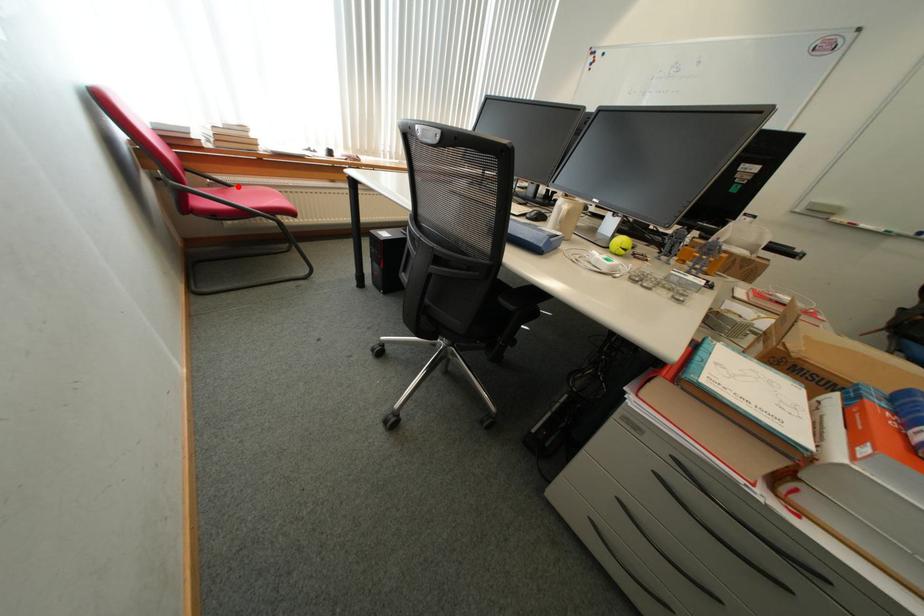
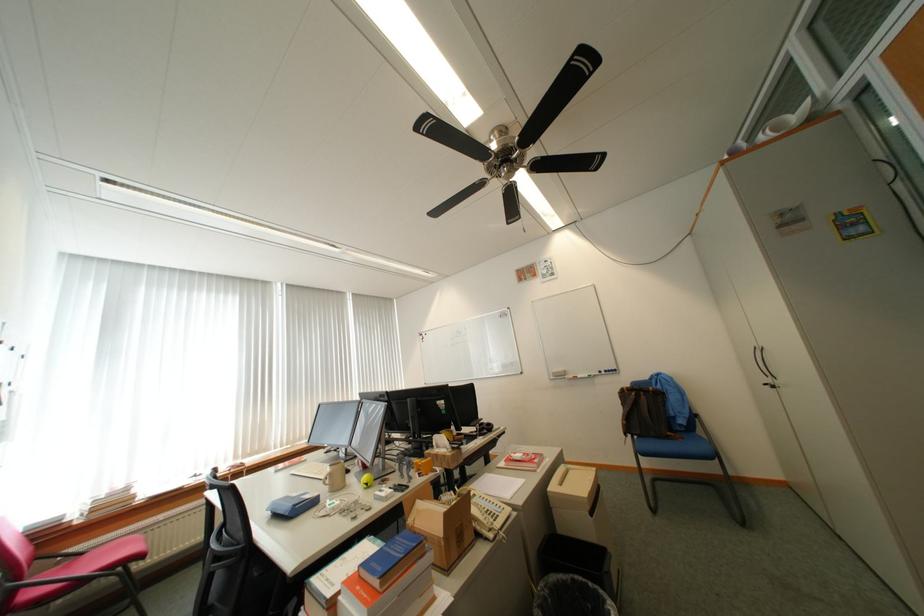
In the second image, find the point that corresponds to the highlighted location in the first image.

(91, 554)